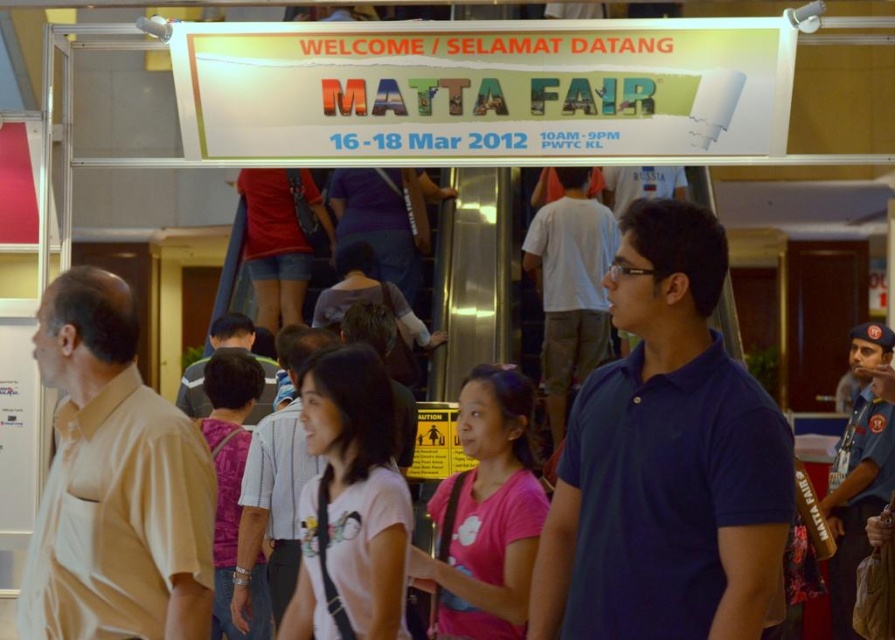
Identify the location of dark blue polo shirt at center. (665, 460).

Can you confirm if white cotton shirt at center is wider than blue uniform at center?

Indeed, white cotton shirt at center has a greater width compared to blue uniform at center.

How far apart are white cotton shirt at center and blue uniform at center?

A distance of 13.26 feet exists between white cotton shirt at center and blue uniform at center.

Is point (233, 620) farther from camera compared to point (837, 470)?

That is False.

This screenshot has height=640, width=895. Identify the location of white cotton shirt at center. (275, 492).

I want to click on dark blue polo shirt at center, so click(x=665, y=460).

Between point (700, 378) and point (198, 369), which one is positioned in front?

Point (700, 378)

Identify the location of dark blue polo shirt at center. (665, 460).